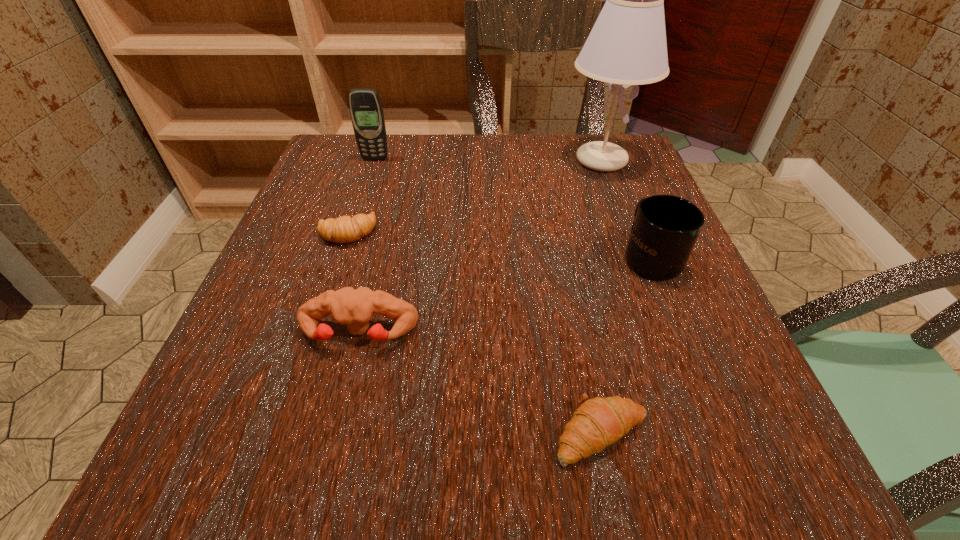
The width and height of the screenshot is (960, 540). I want to click on free space located 0.250m with the handle on the side of the fourth shortest object, so click(x=613, y=164).

The height and width of the screenshot is (540, 960). What are the coordinates of `vacant region located 0.330m with the handle on the side of the fourth shortest object` in the screenshot? It's located at (606, 146).

Find the location of a particular element. free region located with the handle on the side of the fourth shortest object is located at coordinates (621, 183).

Identify the location of free space located with the gloves of the second nearest object facing forward. The width and height of the screenshot is (960, 540). (324, 475).

Locate an element on the screen. free spot located 0.270m on the front of the farther crescent roll is located at coordinates (300, 375).

The height and width of the screenshot is (540, 960). Find the location of `vacant space situated 0.280m on the left of the right crescent roll`. vacant space situated 0.280m on the left of the right crescent roll is located at coordinates (332, 433).

At what (x,y) coordinates should I click in order to perform the action: click on lampshade present at the far edge. Please return your answer as a coordinate pair (x, y). The height and width of the screenshot is (540, 960). Looking at the image, I should click on (627, 45).

Locate an element on the screen. cellular telephone that is at the far edge is located at coordinates (366, 111).

What are the coordinates of `object that is at the near edge` in the screenshot? It's located at (599, 422).

What are the coordinates of `cellular telephone positioned at the left edge` in the screenshot? It's located at (366, 111).